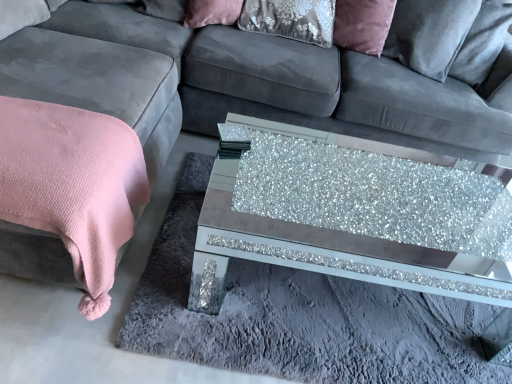
Question: Does pink textured blanket at left have a lesser height compared to velvet/matte pillow at upper center?

Choices:
 (A) no
 (B) yes

Answer: (A)

Question: Is pink textured blanket at left in front of velvet/matte pillow at upper center?

Choices:
 (A) no
 (B) yes

Answer: (B)

Question: Is pink textured blanket at left at the right side of velvet/matte pillow at upper center?

Choices:
 (A) yes
 (B) no

Answer: (B)

Question: From a real-world perspective, is pink textured blanket at left positioned under velvet/matte pillow at upper center based on gravity?

Choices:
 (A) no
 (B) yes

Answer: (B)

Question: Is pink textured blanket at left placed right next to velvet/matte pillow at upper center?

Choices:
 (A) no
 (B) yes

Answer: (A)

Question: Is velvet/matte pillow at upper center to the left or to the right of glittery glass coffee table at center in the image?

Choices:
 (A) left
 (B) right

Answer: (A)

Question: From a real-world perspective, is velvet/matte pillow at upper center above or below glittery glass coffee table at center?

Choices:
 (A) below
 (B) above

Answer: (B)

Question: From the image's perspective, is velvet/matte pillow at upper center positioned above or below glittery glass coffee table at center?

Choices:
 (A) below
 (B) above

Answer: (B)

Question: Do you think velvet/matte pillow at upper center is within glittery glass coffee table at center, or outside of it?

Choices:
 (A) outside
 (B) inside

Answer: (A)

Question: From the image's perspective, relative to pink textured blanket at left, is velvet/matte pillow at upper center above or below?

Choices:
 (A) below
 (B) above

Answer: (B)

Question: Relative to pink textured blanket at left, is velvet/matte pillow at upper center in front or behind?

Choices:
 (A) front
 (B) behind

Answer: (B)

Question: Is point (233, 18) positioned closer to the camera than point (1, 208)?

Choices:
 (A) farther
 (B) closer

Answer: (A)

Question: Considering the positions of velvet/matte pillow at upper center and pink textured blanket at left in the image, is velvet/matte pillow at upper center wider or thinner than pink textured blanket at left?

Choices:
 (A) thin
 (B) wide

Answer: (A)

Question: In terms of size, does glittery glass coffee table at center appear bigger or smaller than pink textured blanket at left?

Choices:
 (A) small
 (B) big

Answer: (B)

Question: Visually, is glittery glass coffee table at center positioned to the left or to the right of pink textured blanket at left?

Choices:
 (A) right
 (B) left

Answer: (A)